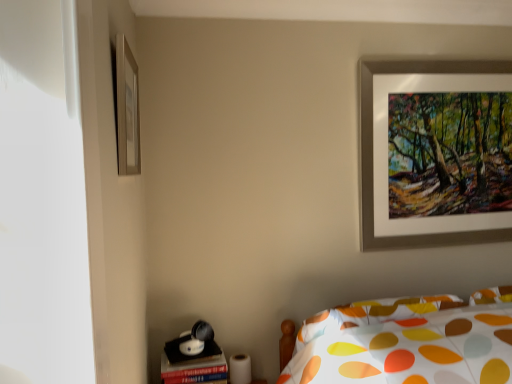
Find the location of a particular element. The height and width of the screenshot is (384, 512). blank space situated above silver metallic picture frame at upper right, which is counted as the second picture frame, starting from the front (from a real-world perspective) is located at coordinates (431, 61).